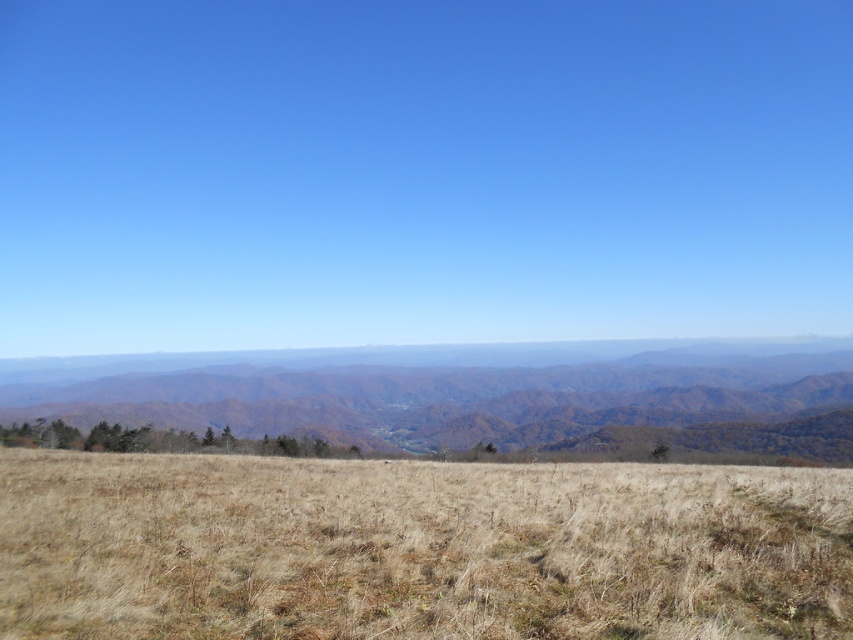
Question: Is brown dry grass at center below brown textured mountains at center?

Choices:
 (A) no
 (B) yes

Answer: (A)

Question: Which of the following is the farthest from the observer?

Choices:
 (A) (393, 557)
 (B) (602, 355)

Answer: (B)

Question: Does brown dry grass at center appear on the left side of brown textured mountains at center?

Choices:
 (A) no
 (B) yes

Answer: (A)

Question: From the image, what is the correct spatial relationship of brown dry grass at center in relation to brown textured mountains at center?

Choices:
 (A) right
 (B) left

Answer: (A)